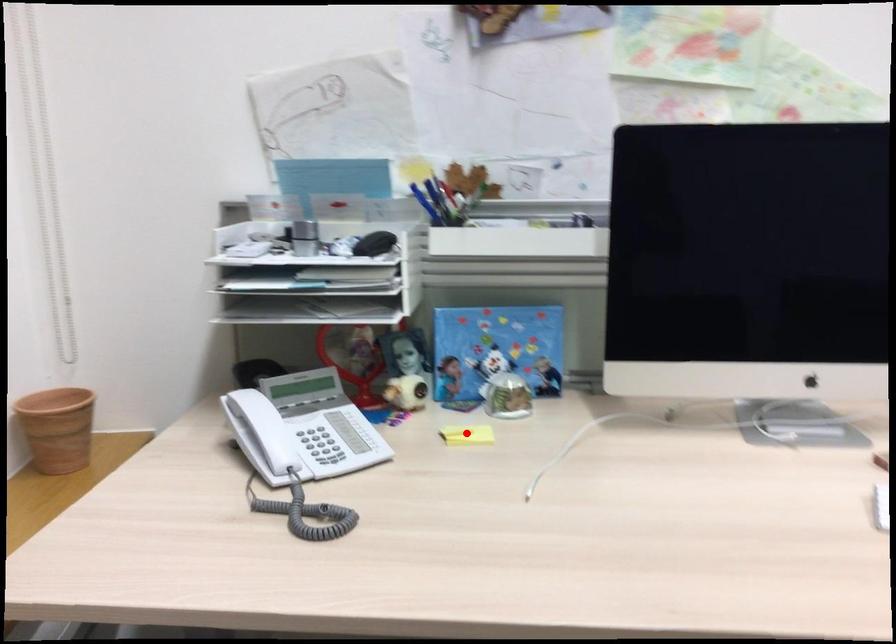
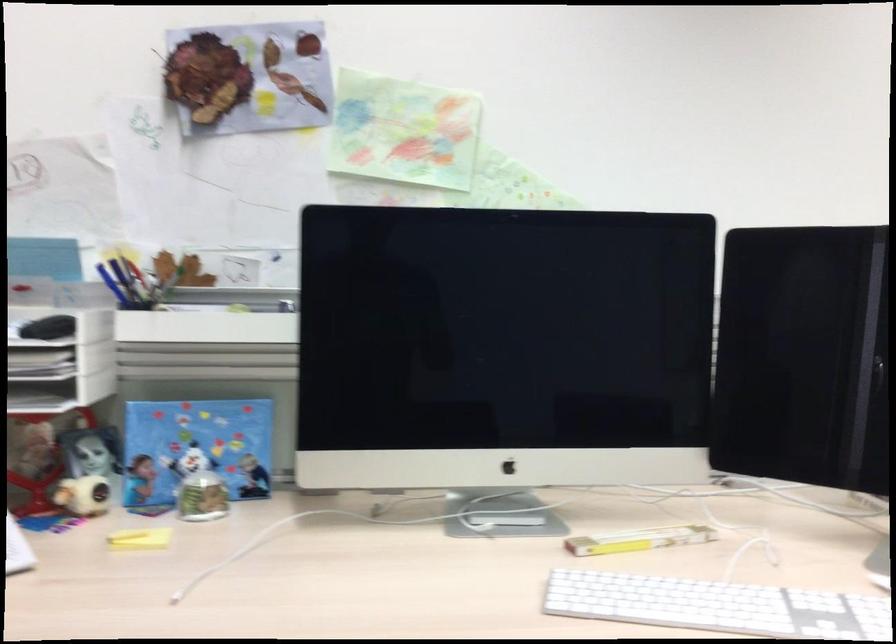
The point at the highlighted location is marked in the first image. Where is the corresponding point in the second image?

(140, 538)